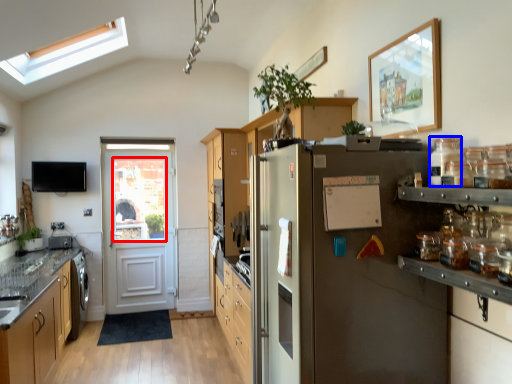
Question: Among these objects, which one is farthest to the camera, window screen (highlighted by a red box) or glass jar (highlighted by a blue box)?

Choices:
 (A) window screen
 (B) glass jar

Answer: (A)